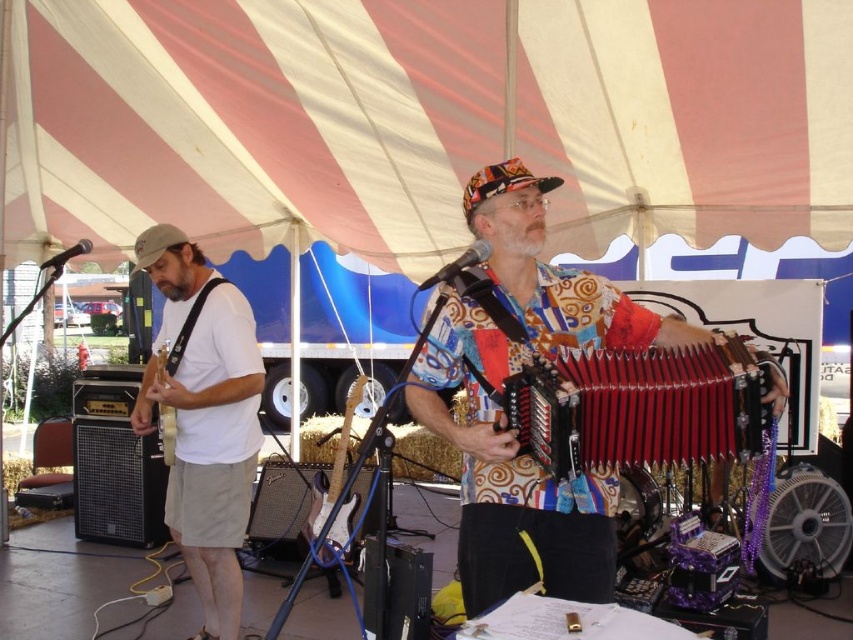
You are an audience member sitting in the front row and want to take a photo of both the multicolored fabric shirt at center and the wooden electric guitar at left. Since you want both in the frame, which direction should you turn your camera to ensure both are visible?

The multicolored fabric shirt at center is positioned on the right side of the wooden electric guitar at left. To include both in the frame, you should center your camera between them, ensuring the right side of the wooden electric guitar at left aligns with the left edge of the frame and the multicolored fabric shirt at center is within the right half of the frame.

You are a photographer at the event and want to capture both the red leather accordion at center and the brown matte beard at left in the same frame. Based on their positions, which one should you focus on first to ensure both are in focus?

The red leather accordion at center is below the brown matte beard at left, so focusing on the brown matte beard at left first would help ensure both are in focus since it is closer to the camera.